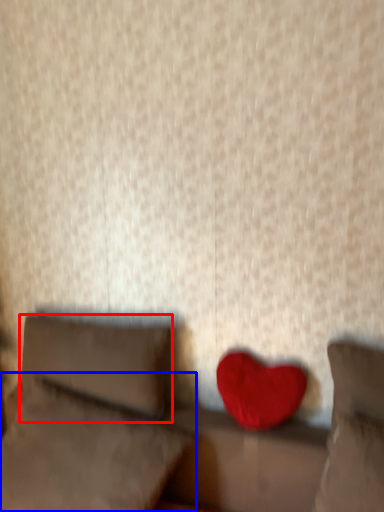
Question: Which point is further to the camera, pillow (highlighted by a red box) or pillow (highlighted by a blue box)?

Choices:
 (A) pillow
 (B) pillow

Answer: (A)